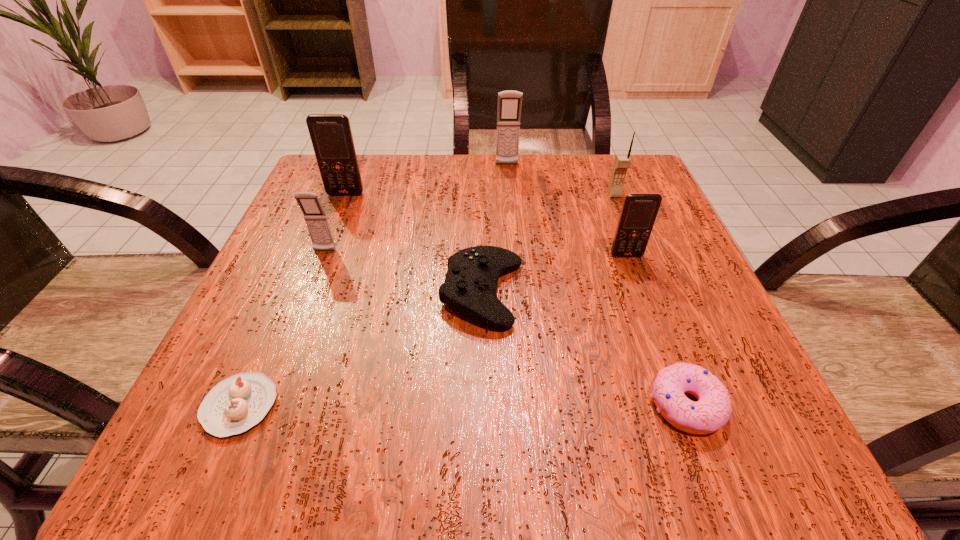
This screenshot has width=960, height=540. What are the coordinates of `vacant space at the right edge` in the screenshot? It's located at (671, 228).

Locate an element on the screen. free space at the far left corner of the desktop is located at coordinates (361, 201).

This screenshot has height=540, width=960. Identify the location of free spot at the far right corner of the desktop. (650, 185).

You are a GUI agent. You are given a task and a screenshot of the screen. Output one action in this format:
    pyautogui.click(x=<x>, y=<y>)
    Task: Click on the vacant region between the pink doughnut and the cupcake
    
    Given the screenshot: What is the action you would take?
    pyautogui.click(x=463, y=406)

This screenshot has height=540, width=960. I want to click on vacant space that is in between the sixth tallest object and the cupcake, so click(361, 350).

The image size is (960, 540). I want to click on vacant area that lies between the sixth tallest object and the left gray cellular telephone, so (x=403, y=272).

This screenshot has width=960, height=540. In order to click on free space that is in between the pink doughnut and the cupcake in this screenshot , I will do `click(463, 406)`.

This screenshot has width=960, height=540. Identify the location of free spot between the farthest cellular telephone and the cupcake. (373, 286).

Find the location of `vacant area between the left orange cellular telephone and the right orange cellular telephone`. vacant area between the left orange cellular telephone and the right orange cellular telephone is located at coordinates (486, 225).

Where is `vacant region between the right orange cellular telephone and the right gray cellular telephone`? vacant region between the right orange cellular telephone and the right gray cellular telephone is located at coordinates (566, 210).